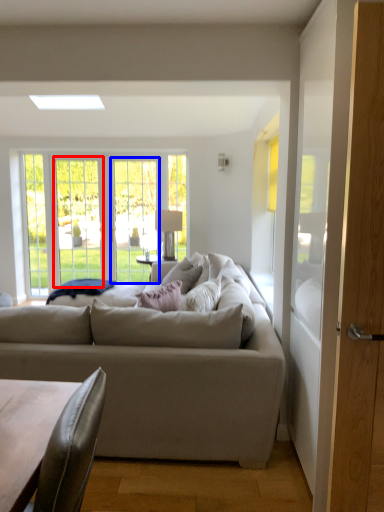
Question: Among these objects, which one is farthest to the camera, glass door (highlighted by a red box) or screen door (highlighted by a blue box)?

Choices:
 (A) glass door
 (B) screen door

Answer: (A)